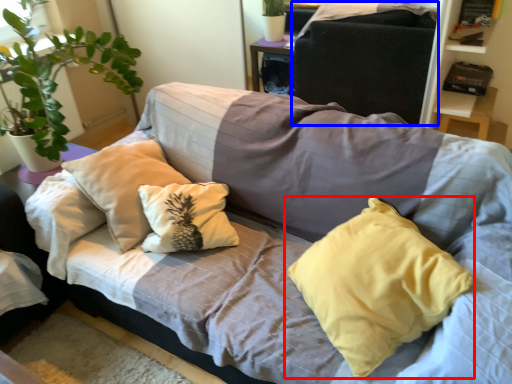
Question: Which point is closer to the camera, pillow (highlighted by a red box) or gray (highlighted by a blue box)?

Choices:
 (A) pillow
 (B) gray

Answer: (A)